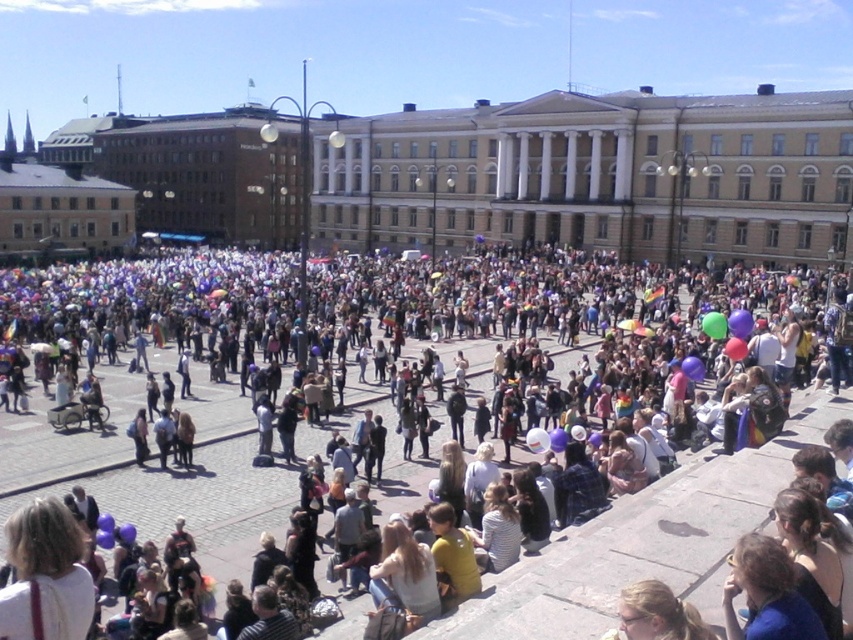
You are a photographer standing in the public square and want to take a photo of the yellow stone building at center without the matte black wheelchair at lower left blocking the view. Is the wheelchair positioned in a way that it might obstruct the building in your shot?

The yellow stone building at center is located above the matte black wheelchair at lower left, so the wheelchair is below the building and would not obstruct the view of the building in your photo.